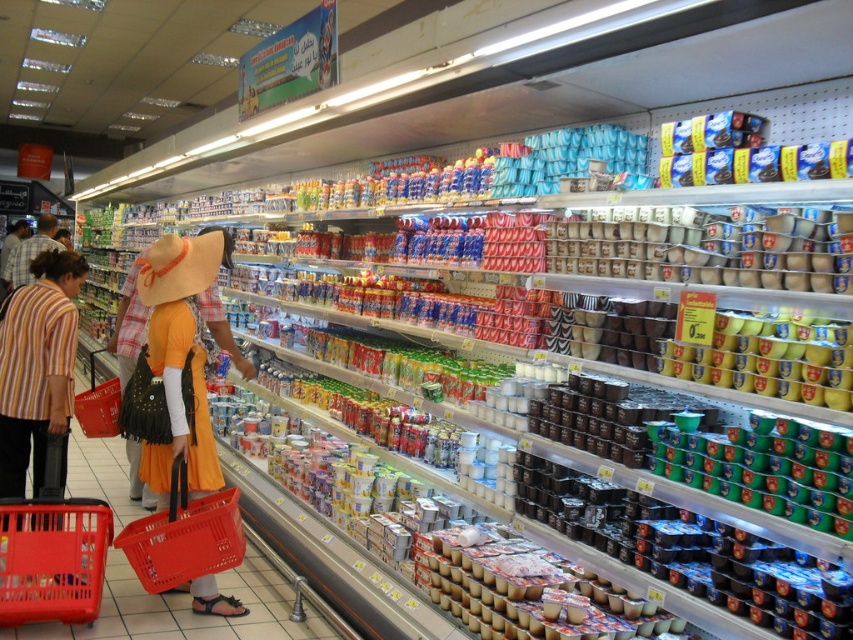
Question: Which object is closer to the camera taking this photo?

Choices:
 (A) white matte yogurt cups at center
 (B) plastic shopping basket at lower left
 (C) matte plastic basket at lower left
 (D) plastic shopping basket at center

Answer: (A)

Question: Is white matte yogurt cups at center wider than matte plastic basket at lower left?

Choices:
 (A) no
 (B) yes

Answer: (A)

Question: Is plastic shopping basket at lower left to the left of matte plastic basket at lower left from the viewer's perspective?

Choices:
 (A) yes
 (B) no

Answer: (B)

Question: Can you confirm if plastic shopping basket at center is positioned to the right of matte plastic basket at lower left?

Choices:
 (A) yes
 (B) no

Answer: (A)

Question: Considering the real-world distances, which object is farthest from the plastic shopping basket at lower left?

Choices:
 (A) plastic shopping basket at center
 (B) matte yellow dress at center
 (C) matte plastic basket at lower left
 (D) white matte yogurt cups at center

Answer: (D)

Question: Based on their relative distances, which object is nearer to the matte plastic basket at lower left?

Choices:
 (A) plastic shopping basket at center
 (B) matte yellow dress at center
 (C) plastic shopping basket at lower left

Answer: (C)